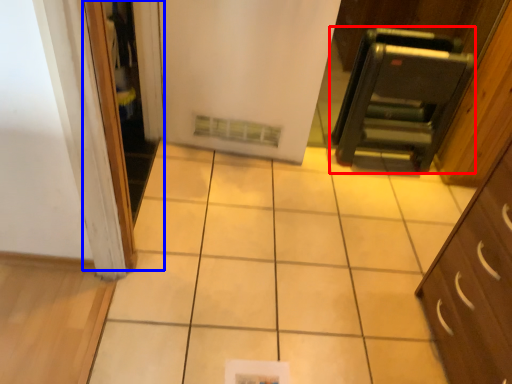
Question: Which object appears closest to the camera in this image, appliance (highlighted by a red box) or screen door (highlighted by a blue box)?

Choices:
 (A) appliance
 (B) screen door

Answer: (B)